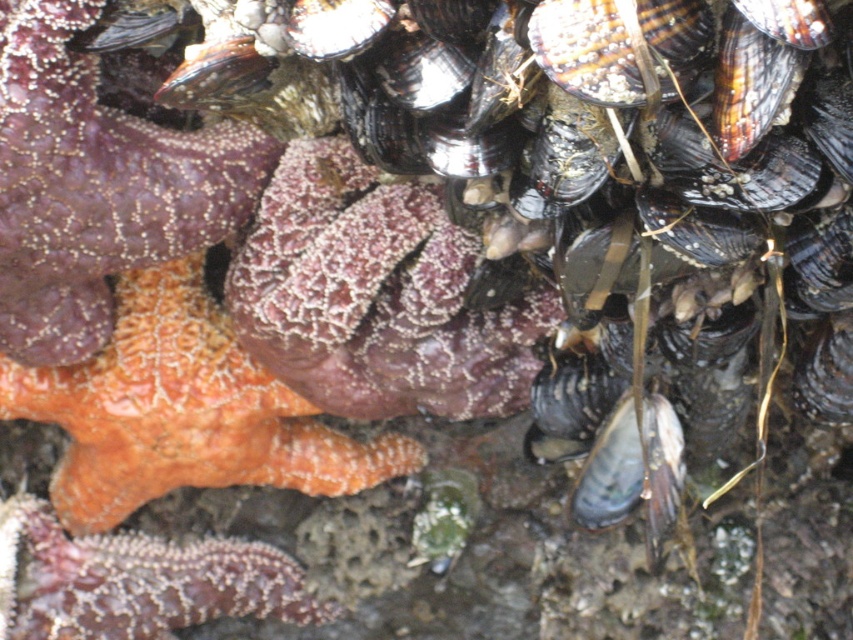
Question: Is orange rough starfish at upper left to the left of orange textured starfish at lower left from the viewer's perspective?

Choices:
 (A) no
 (B) yes

Answer: (A)

Question: Which point appears farthest from the camera in this image?

Choices:
 (A) (26, 528)
 (B) (177, 355)
 (C) (78, 256)

Answer: (A)

Question: Among these points, which one is farthest from the camera?

Choices:
 (A) (61, 45)
 (B) (103, 534)

Answer: (B)

Question: Does orange rough starfish at upper left have a lesser width compared to orange sponge at center?

Choices:
 (A) yes
 (B) no

Answer: (A)

Question: Is the position of orange sponge at center less distant than that of orange textured starfish at lower left?

Choices:
 (A) no
 (B) yes

Answer: (B)

Question: Estimate the real-world distances between objects in this image. Which object is farther from the orange sponge at center?

Choices:
 (A) orange textured starfish at lower left
 (B) orange rough starfish at upper left

Answer: (B)